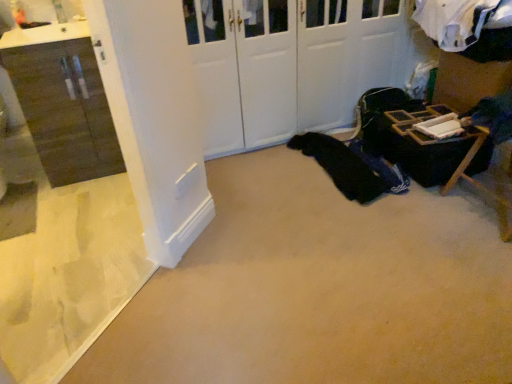
Locate an element on the screen. The height and width of the screenshot is (384, 512). free space on the front side of black fabric at center is located at coordinates (354, 223).